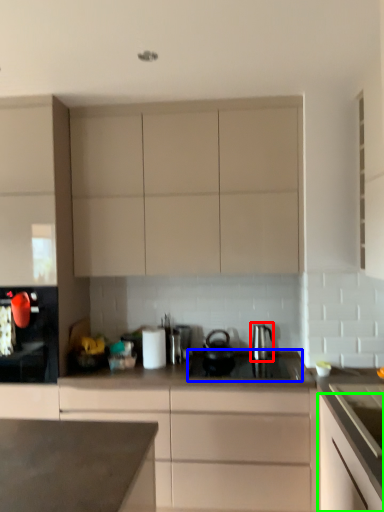
Question: Considering the real-world distances, which object is closest to kitchen appliance (highlighted by a red box)? gas stove (highlighted by a blue box) or cabinetry (highlighted by a green box).

Choices:
 (A) gas stove
 (B) cabinetry

Answer: (A)